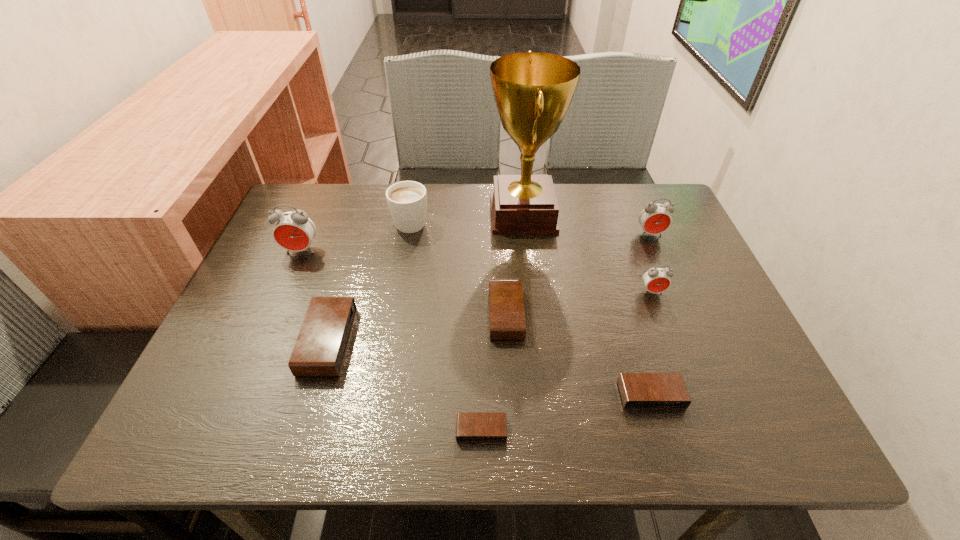
This screenshot has width=960, height=540. Identify the location of free space at the right edge of the desktop. tap(685, 270).

This screenshot has width=960, height=540. I want to click on vacant space at the far left corner of the desktop, so click(x=316, y=184).

Image resolution: width=960 pixels, height=540 pixels. Find the location of `free space at the far right corner`. free space at the far right corner is located at coordinates (634, 209).

Identify the location of vacant space that's between the tallest object and the second nearest object. (587, 304).

What are the coordinates of `unoccupied position between the tallest object and the sixth alarm clock from right to left` in the screenshot? It's located at (425, 278).

Locate an element on the screen. The height and width of the screenshot is (540, 960). free space between the tallest alarm clock and the third object from left to right is located at coordinates coord(356,235).

The height and width of the screenshot is (540, 960). I want to click on free area in between the nearest object and the third tallest alarm clock, so click(x=566, y=361).

This screenshot has width=960, height=540. I want to click on free space between the fifth shortest alarm clock and the third shortest alarm clock, so click(x=579, y=303).

At what (x,y) coordinates should I click in order to perform the action: click on free space between the tallest object and the farthest red alarm clock. Please return your answer as a coordinate pair (x, y). Looking at the image, I should click on (587, 224).

The width and height of the screenshot is (960, 540). Identify the location of vacant region between the tallest alarm clock and the leftmost black alarm clock. (315, 296).